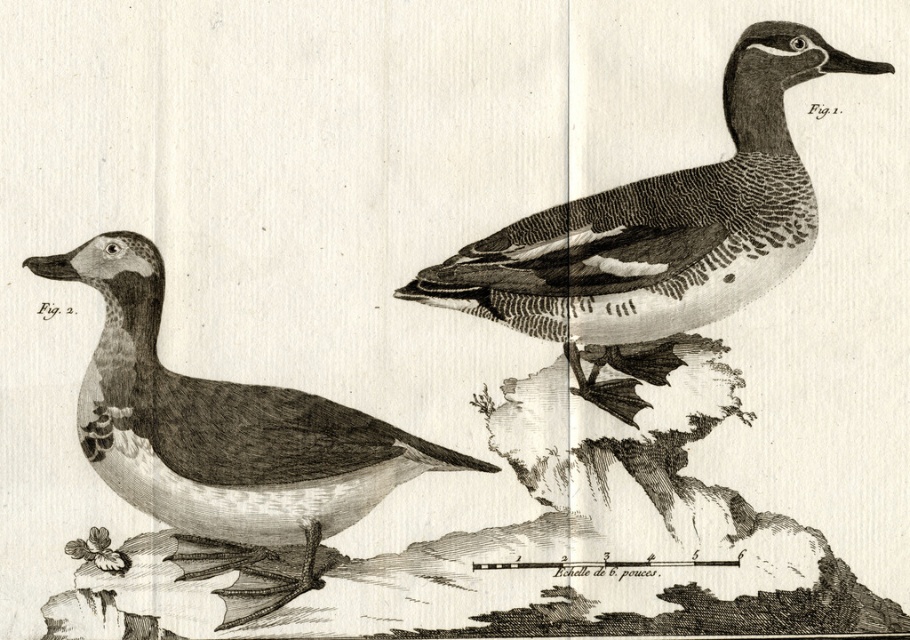
Based on the coordinates provided in the scientific illustration, where is the etched wood duck at upper right positioned relative to the other duck?

The etched wood duck at upper right is located at point (658, 236), which places it to the upper right of the other duck in the image.

You are an ornithologist examining the illustration. You need to determine the spatial relationship between the two ducks. Based on the image, is the etched wood duck at upper right positioned to the left or to the right of the smooth black duck at left?

The etched wood duck at upper right is positioned to the right of the smooth black duck at left.